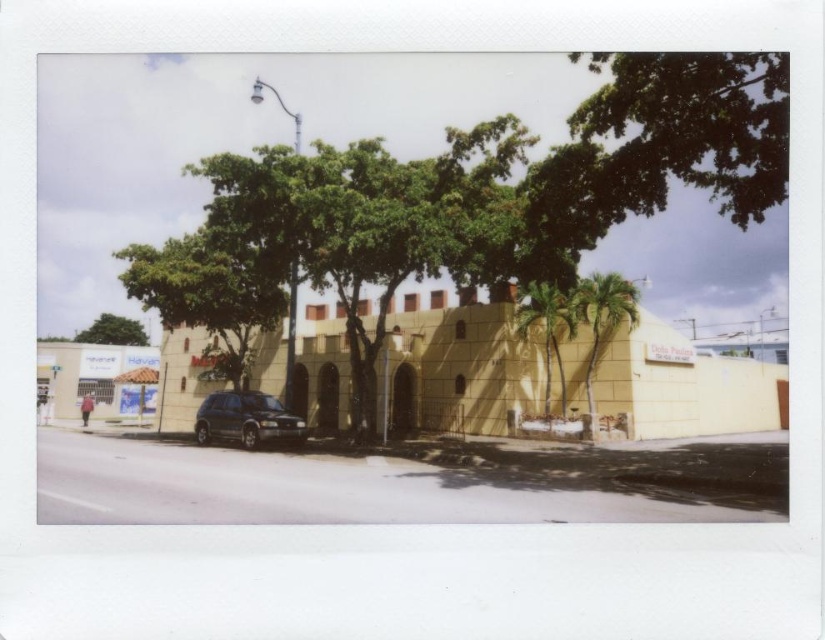
Who is positioned more to the left, green leafy palm tree at right or green leafy palm tree at center-right?

green leafy palm tree at center-right is more to the left.

In order to click on green leafy palm tree at right in this screenshot , I will do `click(602, 316)`.

Can you confirm if satin black suv at center is smaller than green leafy palm tree at center-right?

Correct, satin black suv at center occupies less space than green leafy palm tree at center-right.

Between point (217, 428) and point (566, 326), which one is positioned in front?

Point (217, 428) is in front.

Where is `satin black suv at center`? The width and height of the screenshot is (825, 640). satin black suv at center is located at coordinates (246, 419).

Is green leafy tree at upper right to the right of green leafy palm tree at center-right from the viewer's perspective?

Correct, you'll find green leafy tree at upper right to the right of green leafy palm tree at center-right.

This screenshot has height=640, width=825. What do you see at coordinates (691, 129) in the screenshot? I see `green leafy tree at upper right` at bounding box center [691, 129].

Does point (687, 122) lie in front of point (564, 374)?

Yes, it is.

Identify the location of green leafy tree at upper right. (691, 129).